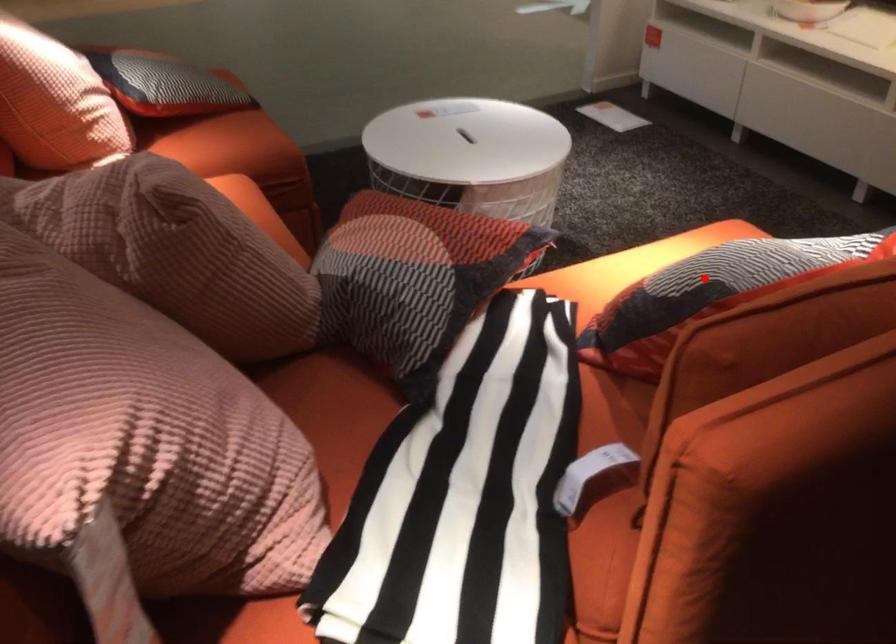
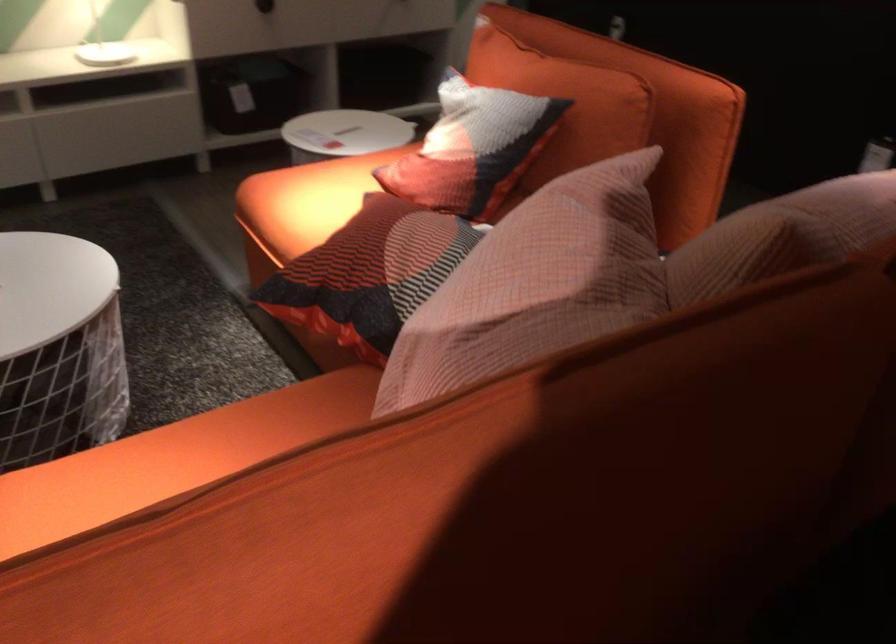
Where in the second image is the point corresponding to the highlighted location from the first image?

(564, 102)